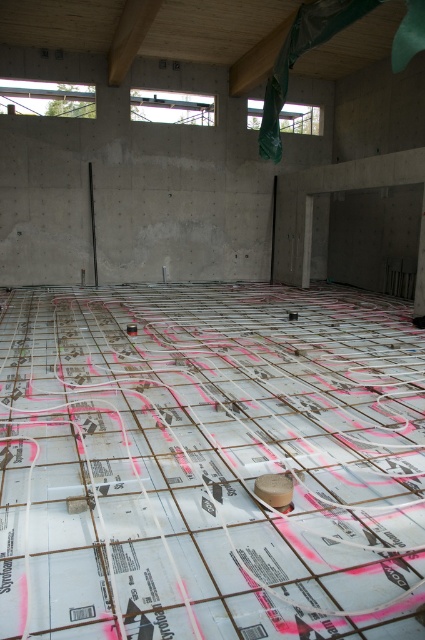
Question: Is white grid concrete at center smaller than white matte tape at center?

Choices:
 (A) yes
 (B) no

Answer: (B)

Question: Does white grid concrete at center come in front of white matte tape at center?

Choices:
 (A) no
 (B) yes

Answer: (B)

Question: Which object is closer to the camera taking this photo?

Choices:
 (A) white matte tape at center
 (B) white grid concrete at center

Answer: (B)

Question: Observing the image, what is the correct spatial positioning of white grid concrete at center in reference to white matte tape at center?

Choices:
 (A) above
 (B) below

Answer: (A)

Question: Which point appears farthest from the camera in this image?

Choices:
 (A) click(224, 630)
 (B) click(289, 486)

Answer: (B)